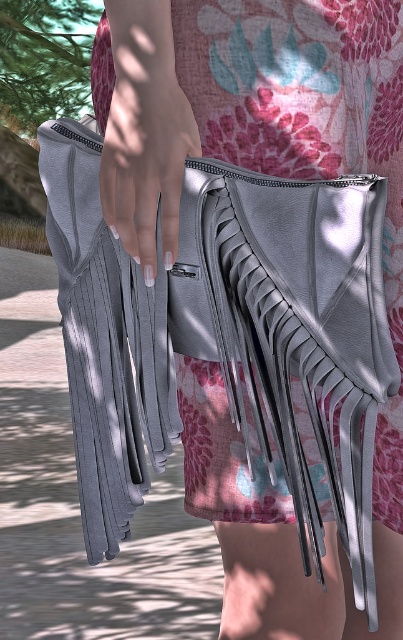
Does point (214, 1) come closer to viewer compared to point (184, 138)?

No, (214, 1) is behind (184, 138).

In order to click on matte gray leather dress at center in this screenshot , I will do `click(309, 125)`.

Who is more distant from viewer, (319, 35) or (128, 218)?

Point (319, 35)

Find the location of a particular element. matte gray leather dress at center is located at coordinates (309, 125).